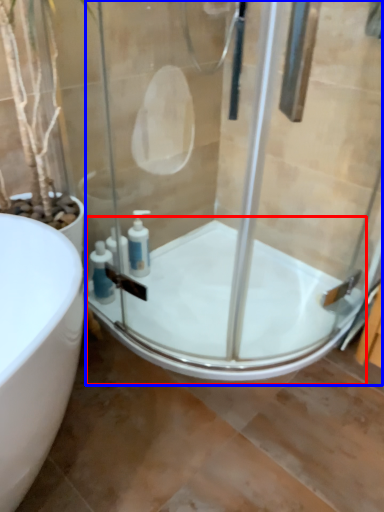
Question: Which object is further to the camera taking this photo, bath (highlighted by a red box) or shower door (highlighted by a blue box)?

Choices:
 (A) bath
 (B) shower door

Answer: (A)